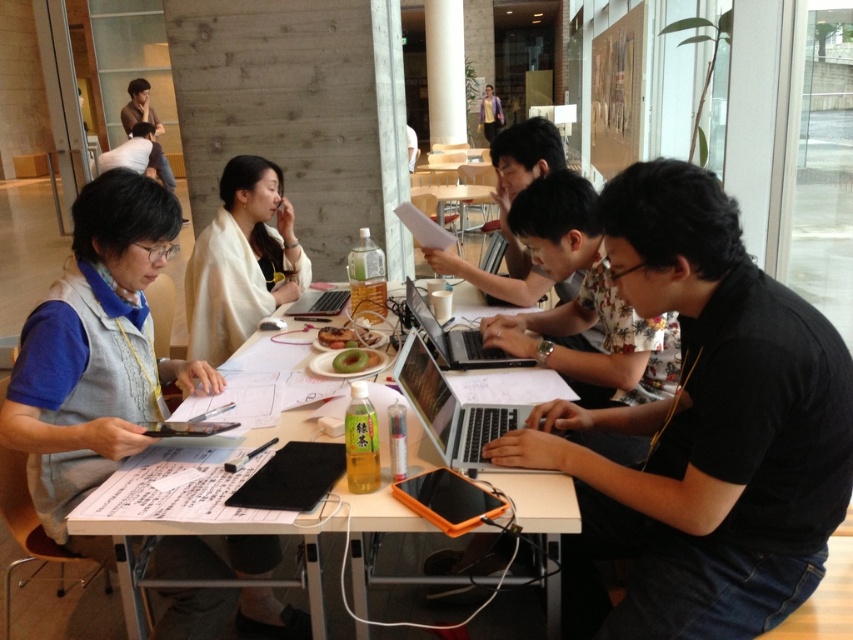
Question: Is black matte shirt at center thinner than matte black laptop at center?

Choices:
 (A) no
 (B) yes

Answer: (A)

Question: Which point is closer to the camera?

Choices:
 (A) (287, 292)
 (B) (532, 401)
 (C) (525, 184)

Answer: (B)

Question: Which is farther from the matte blue shirt at left?

Choices:
 (A) silver/black laptop at center
 (B) matte white shirt at upper left
 (C) silver metallic laptop at center

Answer: (B)

Question: Can you confirm if silver/black laptop at center is positioned to the left of green matte apple at center?

Choices:
 (A) yes
 (B) no

Answer: (B)

Question: Does black matte shirt at center appear over matte white shirt at upper left?

Choices:
 (A) yes
 (B) no

Answer: (B)

Question: Which of the following is the farthest from the observer?

Choices:
 (A) (325, 340)
 (B) (451, 410)
 (C) (413, 292)
 (D) (364, 349)

Answer: (A)